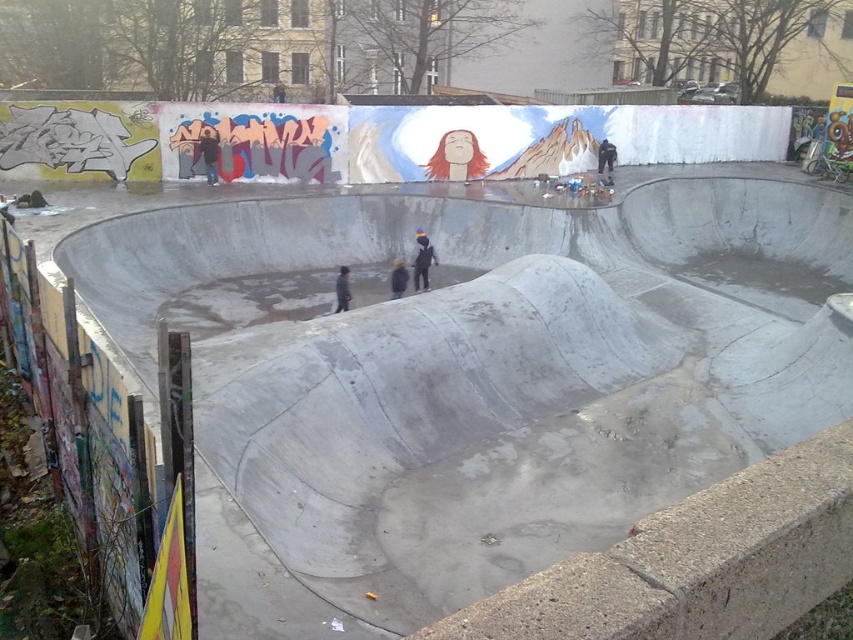
You are a photographer standing at the entrance of the skatepark. You want to capture a photo of both the concrete skate park at center and the dark gray jacket at center. Which object should you focus on first to ensure both are in the frame?

The concrete skate park at center is above the dark gray jacket at center, so you should focus on the dark gray jacket at center first to ensure both are in the frame.

You are a photographer aiming to capture the skateboarder and the jacket in the same frame. Based on their positions, will the dark blue jacket at upper center be visible behind the dark gray concrete skateboarder at center?

The dark gray concrete skateboarder at center is in front of the dark blue jacket at upper center, so the dark blue jacket at upper center will be visible behind the dark gray concrete skateboarder at center.